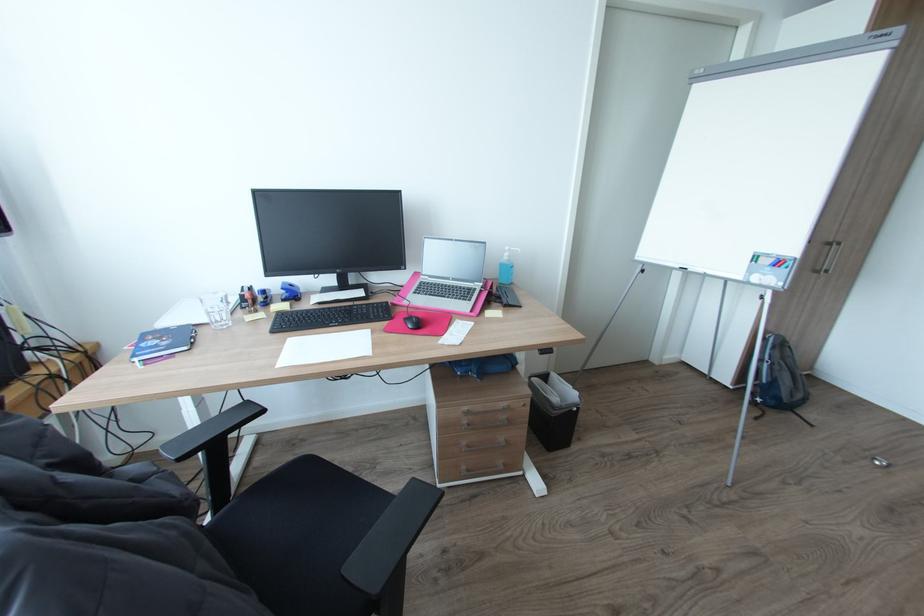
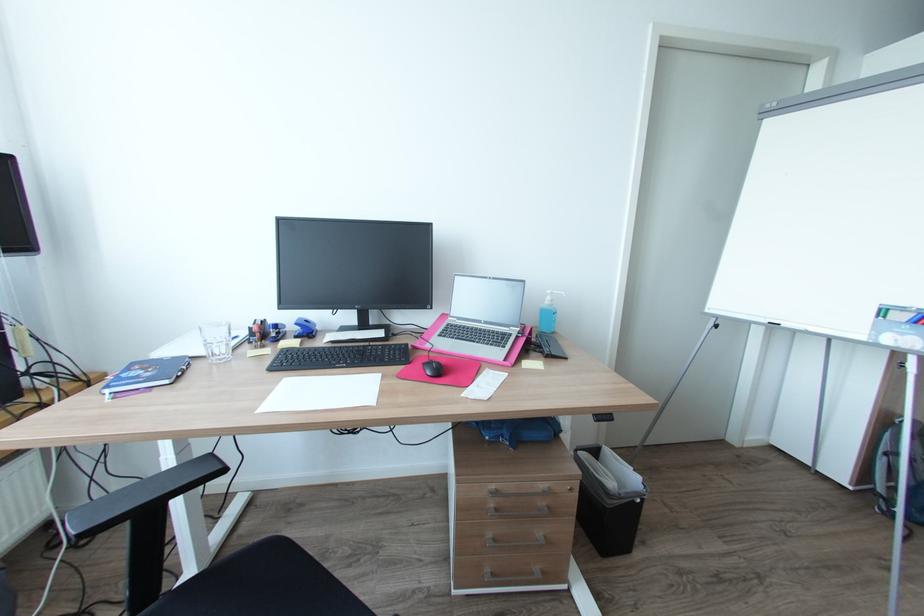
In the second image, find the point that corresponds to [189,347] in the first image.

(171, 381)